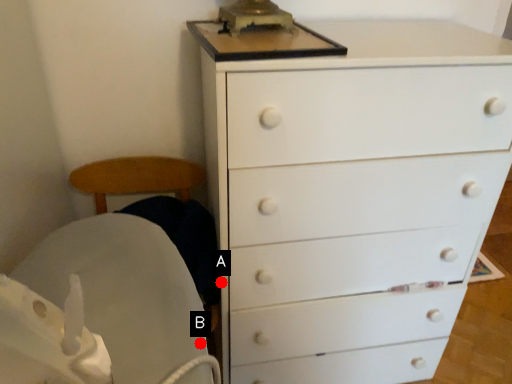
Question: Two points are circled on the image, labeled by A and B beside each circle. Which of the following is the farthest from the observer?

Choices:
 (A) A is further
 (B) B is further

Answer: (A)